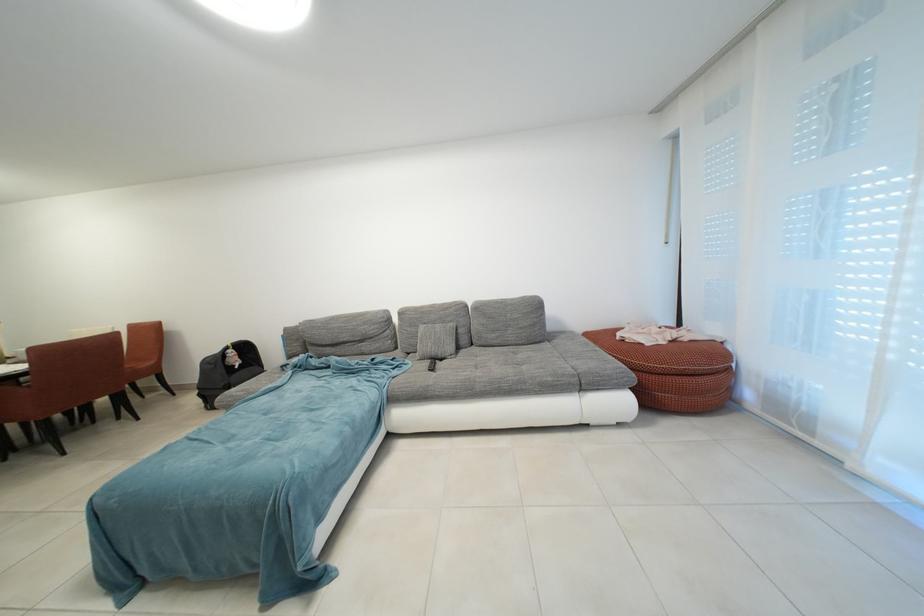
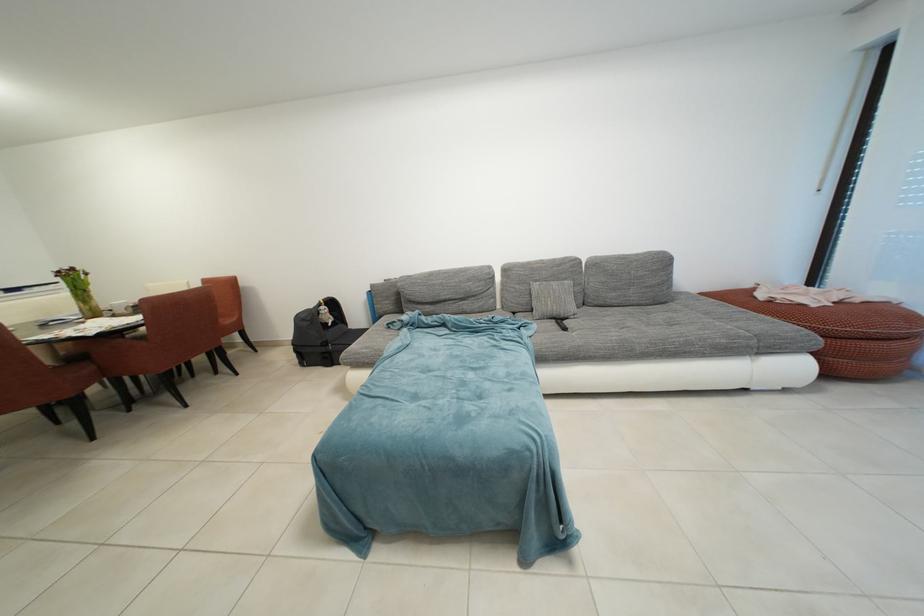
The point at (434, 368) is marked in the first image. Where is the corresponding point in the second image?

(560, 328)